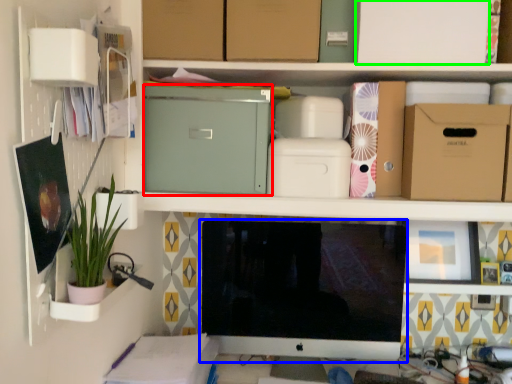
Question: Which is farther away from cardboard box (highlighted by a red box)? computer monitor (highlighted by a blue box) or cardboard box (highlighted by a green box)?

Choices:
 (A) computer monitor
 (B) cardboard box

Answer: (B)